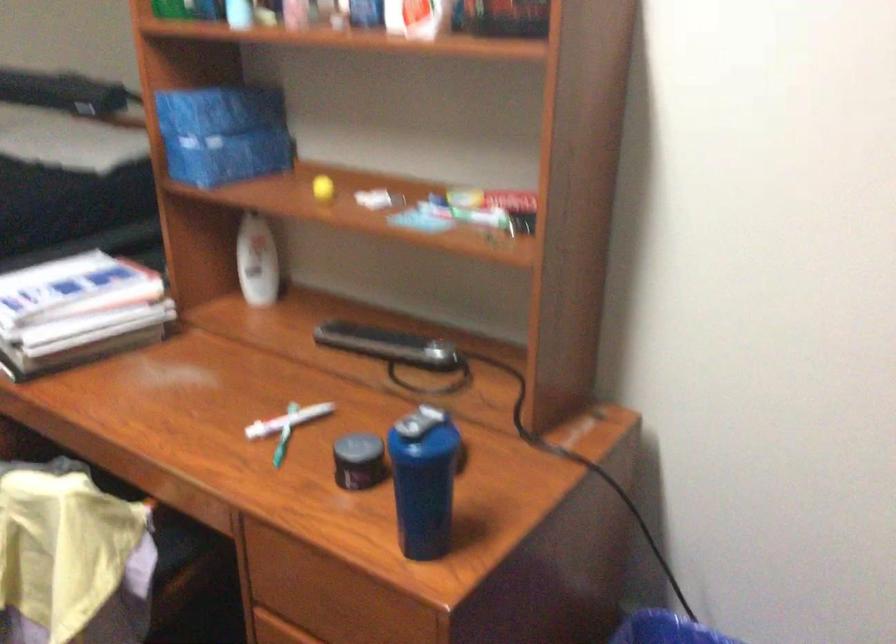
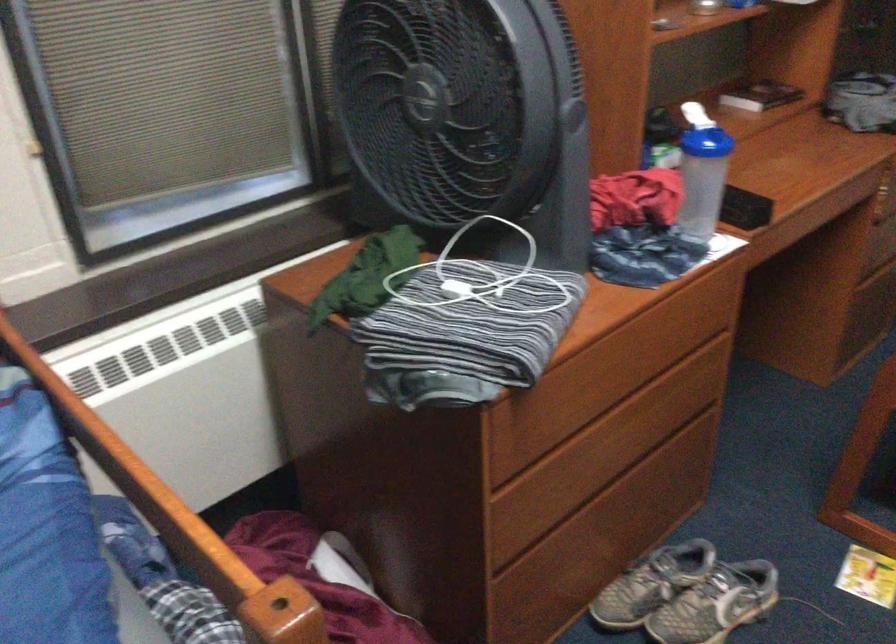
First-person continuous shooting, in which direction is the camera rotating?

The camera's rotation is toward left-down.